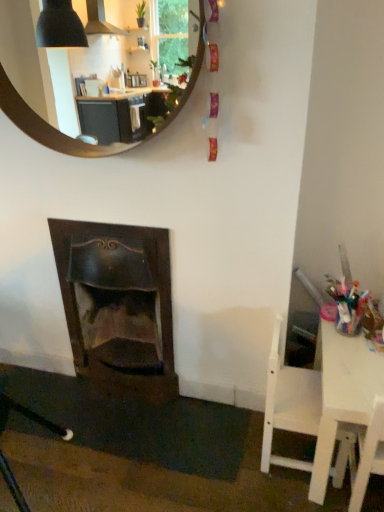
Question: Could you tell me if wooden round mirror at upper center is turned towards dark wood fireplace at lower left?

Choices:
 (A) no
 (B) yes

Answer: (A)

Question: Is wooden round mirror at upper center bigger than dark wood fireplace at lower left?

Choices:
 (A) yes
 (B) no

Answer: (B)

Question: Can you confirm if wooden round mirror at upper center is taller than dark wood fireplace at lower left?

Choices:
 (A) no
 (B) yes

Answer: (A)

Question: Does wooden round mirror at upper center have a greater width compared to dark wood fireplace at lower left?

Choices:
 (A) no
 (B) yes

Answer: (A)

Question: Would you say wooden round mirror at upper center contains dark wood fireplace at lower left?

Choices:
 (A) yes
 (B) no

Answer: (B)

Question: From a real-world perspective, is white wood chair at lower right above or below wooden round mirror at upper center?

Choices:
 (A) below
 (B) above

Answer: (A)

Question: Considering the positions of white wood chair at lower right and wooden round mirror at upper center in the image, is white wood chair at lower right taller or shorter than wooden round mirror at upper center?

Choices:
 (A) short
 (B) tall

Answer: (B)

Question: Is point (299, 368) closer or farther from the camera than point (49, 125)?

Choices:
 (A) farther
 (B) closer

Answer: (A)

Question: Choose the correct answer: Is white wood chair at lower right inside wooden round mirror at upper center or outside it?

Choices:
 (A) outside
 (B) inside

Answer: (A)

Question: From the image's perspective, relative to white plastic table at right, is dark wood fireplace at lower left above or below?

Choices:
 (A) below
 (B) above

Answer: (B)

Question: In terms of width, does dark wood fireplace at lower left look wider or thinner when compared to white plastic table at right?

Choices:
 (A) wide
 (B) thin

Answer: (B)

Question: From their relative heights in the image, would you say dark wood fireplace at lower left is taller or shorter than white plastic table at right?

Choices:
 (A) short
 (B) tall

Answer: (B)

Question: Would you say dark wood fireplace at lower left is inside or outside white plastic table at right?

Choices:
 (A) inside
 (B) outside

Answer: (B)

Question: From the image's perspective, relative to dark wood fireplace at lower left, is white wood chair at lower right above or below?

Choices:
 (A) below
 (B) above

Answer: (A)

Question: Does point (292, 378) appear closer or farther from the camera than point (66, 323)?

Choices:
 (A) farther
 (B) closer

Answer: (B)